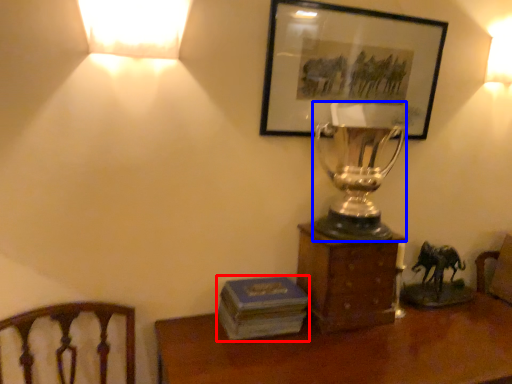
Question: Which object is closer to the camera taking this photo, paperback book (highlighted by a red box) or candle holder (highlighted by a blue box)?

Choices:
 (A) paperback book
 (B) candle holder

Answer: (B)